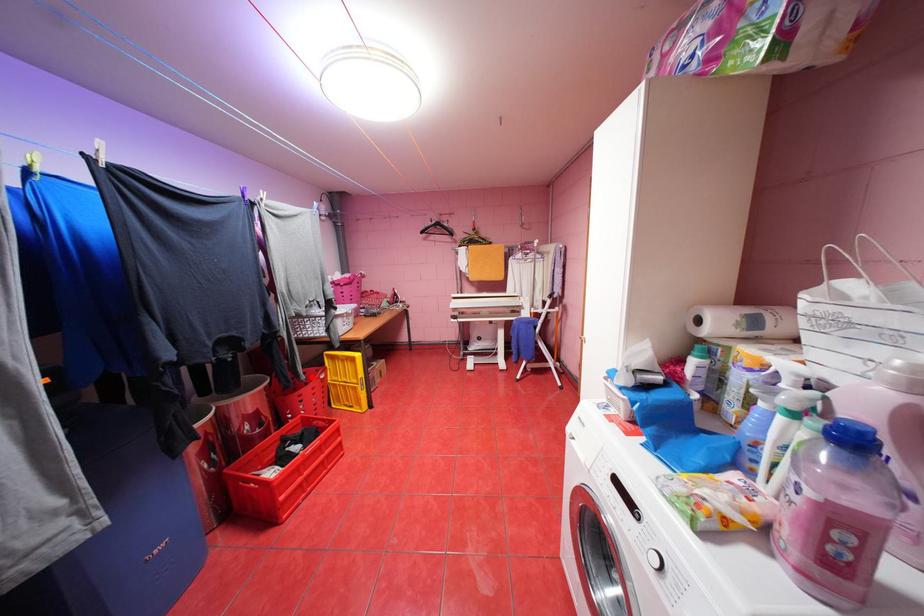
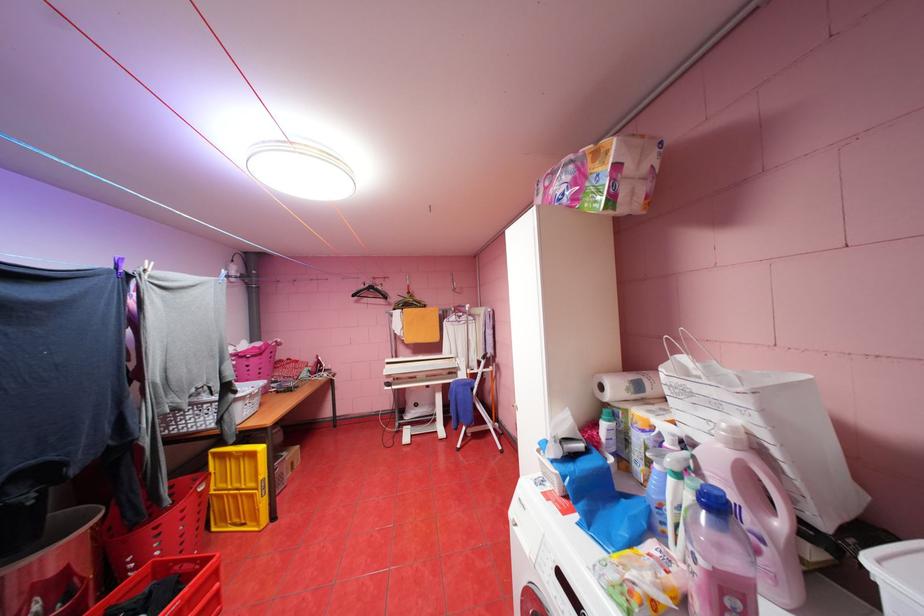
Locate, in the second image, the point that corresponds to the highlighted location in the first image.

(176, 501)